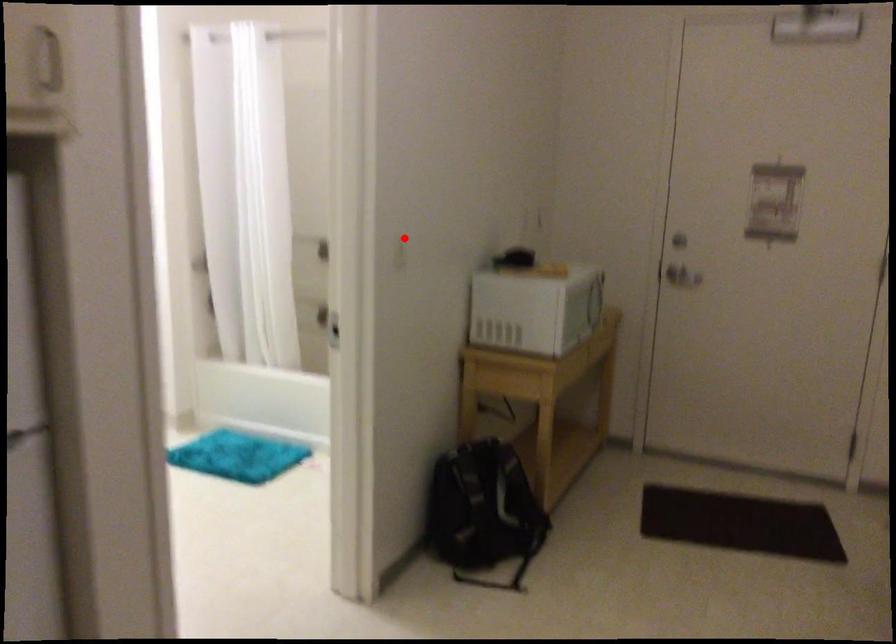
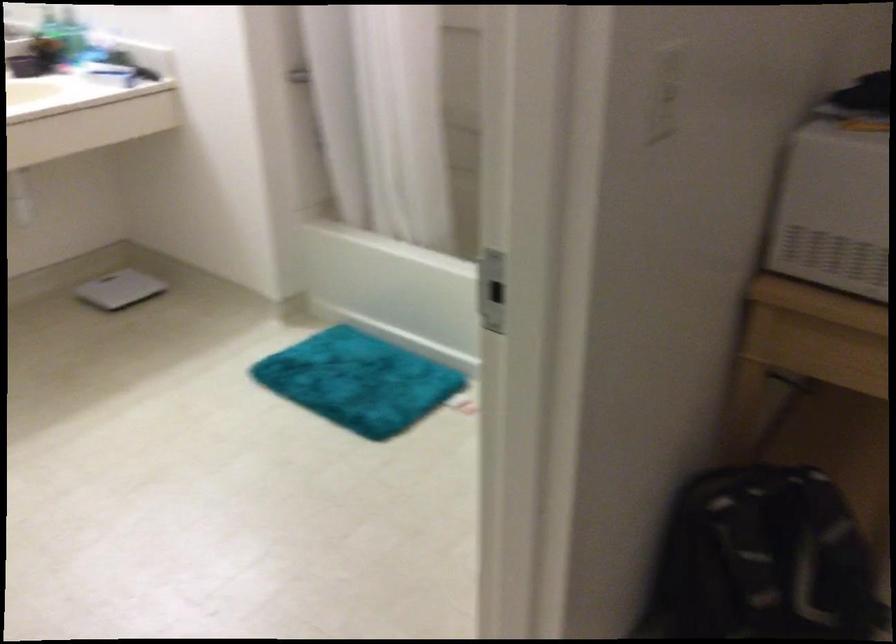
Question: I am providing you with two images of the same scene from different viewpoints. In image1, a red point is highlighted. Considering the same 3D point in image2, which of the following is correct?

Choices:
 (A) It is closer
 (B) It is farther

Answer: (A)